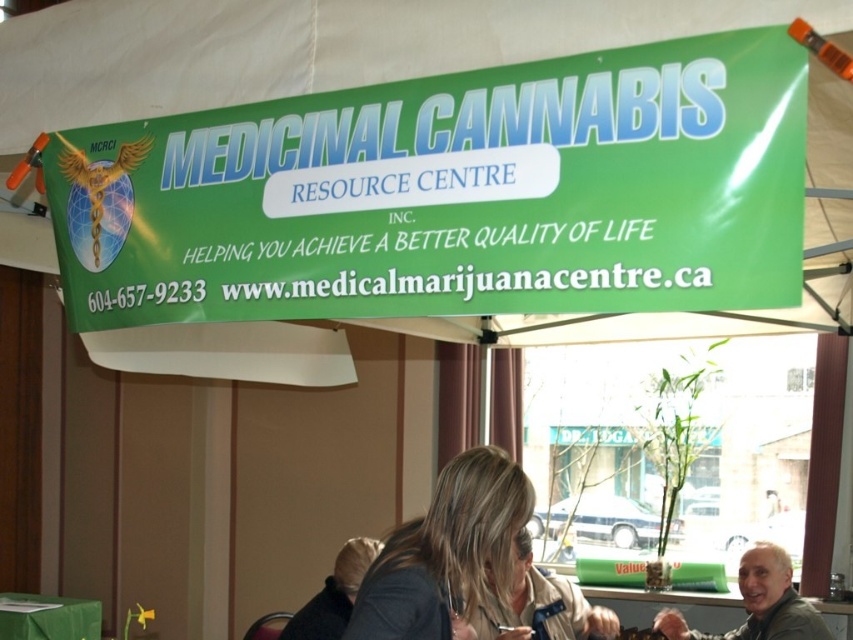
Question: Considering the real-world distances, which object is farthest from the gray fabric jacket at lower right?

Choices:
 (A) green fabric table at lower left
 (B) blonde hair at center
 (C) green matte banner at upper center

Answer: (A)

Question: Can you confirm if green matte banner at upper center is positioned to the right of gray fabric jacket at lower right?

Choices:
 (A) yes
 (B) no

Answer: (B)

Question: Observing the image, what is the correct spatial positioning of blonde hair at center in reference to green fabric table at lower left?

Choices:
 (A) above
 (B) below

Answer: (A)

Question: Which object is farther from the camera taking this photo?

Choices:
 (A) green fabric table at lower left
 (B) gray fabric jacket at lower right

Answer: (A)

Question: From the image, what is the correct spatial relationship of gray fabric jacket at lower right in relation to green fabric table at lower left?

Choices:
 (A) above
 (B) below

Answer: (A)

Question: Based on their relative distances, which object is farther from the blonde hair at center?

Choices:
 (A) green fabric table at lower left
 (B) gray fabric jacket at lower right

Answer: (A)